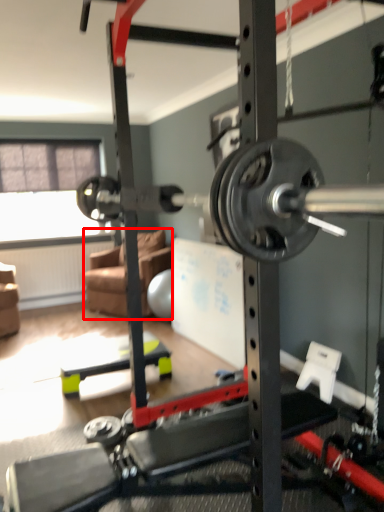
Question: Where is couch (annotated by the red box) located in relation to window screen in the image?

Choices:
 (A) left
 (B) right

Answer: (B)